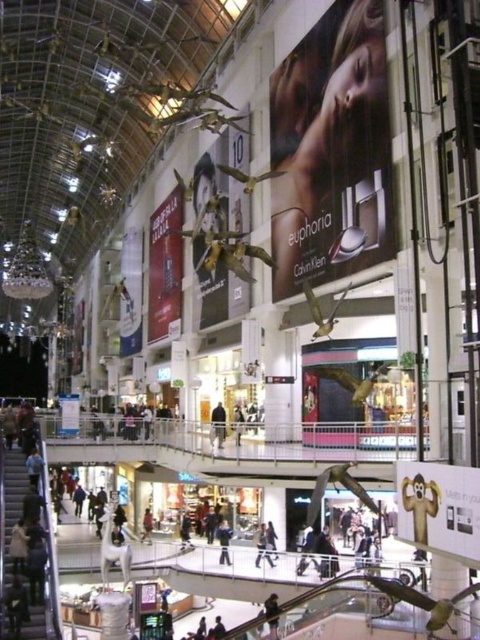
Does blue denim jeans at lower center have a lesser width compared to black leather jacket at center?

Yes, blue denim jeans at lower center is thinner than black leather jacket at center.

I want to click on blue denim jeans at lower center, so click(224, 541).

I want to click on blue denim jeans at lower center, so click(x=224, y=541).

How much distance is there between gold metallic monkey at center and black leather jacket at center?

They are 31.52 meters apart.

Image resolution: width=480 pixels, height=640 pixels. What do you see at coordinates (440, 508) in the screenshot?
I see `gold metallic monkey at center` at bounding box center [440, 508].

I want to click on gold metallic monkey at center, so click(440, 508).

Is point (268, 618) in front of point (230, 532)?

Yes.

Between point (273, 628) and point (226, 532), which one is positioned behind?

Positioned behind is point (226, 532).

Does point (272, 624) lie behind point (220, 548)?

No, it is in front of (220, 548).

At what (x,y) coordinates should I click in order to perform the action: click on dark blue jeans at lower center. Please return your answer as a coordinate pair (x, y). This screenshot has height=640, width=480. Looking at the image, I should click on (272, 614).